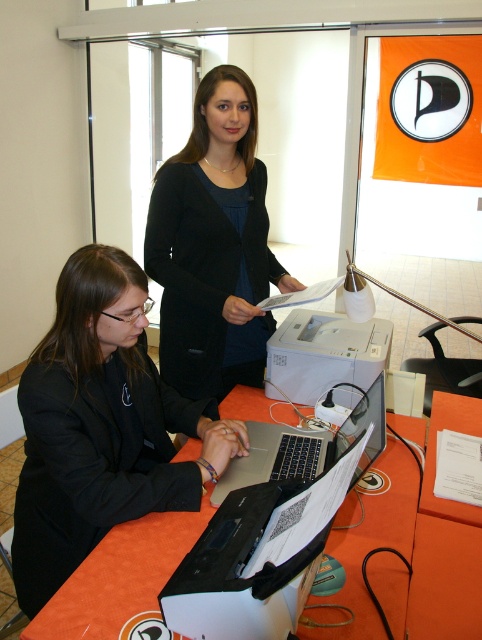
Does black matte laptop at lower left appear over orange fabric table at lower center?

Indeed, black matte laptop at lower left is positioned over orange fabric table at lower center.

Does black matte laptop at lower left lie in front of orange fabric table at lower center?

No, it is behind orange fabric table at lower center.

Who is more forward, (x=50, y=422) or (x=338, y=538)?

Point (x=50, y=422) is more forward.

At what (x,y) coordinates should I click in order to perform the action: click on black matte laptop at lower left. Please return your answer as a coordinate pair (x, y). This screenshot has height=640, width=482. Looking at the image, I should click on (102, 426).

Is black matte laptop at lower left above silver metallic laptop at center?

Actually, black matte laptop at lower left is below silver metallic laptop at center.

In the scene shown: Is black matte laptop at lower left to the left of silver metallic laptop at center from the viewer's perspective?

Yes, black matte laptop at lower left is to the left of silver metallic laptop at center.

Which is in front, point (119, 403) or point (215, 504)?

Point (215, 504) is more forward.

Identify the location of black matte laptop at lower left. (102, 426).

Which is in front, point (93, 444) or point (198, 157)?

Point (93, 444) is in front.

Who is lower down, black matte laptop at lower left or black matte blazer at upper center?

black matte laptop at lower left is below.

Identify the location of black matte laptop at lower left. The height and width of the screenshot is (640, 482). (102, 426).